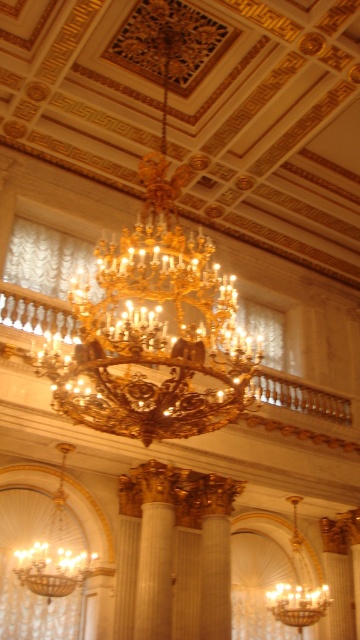
You are an interior designer planning to place a new sofa in this grand hall. You want to position it directly between the matte gold chandelier at lower left and the gold metallic chandelier at center. Can you confirm if there is enough space between them to place the sofa?

The matte gold chandelier at lower left is to the left of gold metallic chandelier at center, so there is space between them. However, the exact distance isn